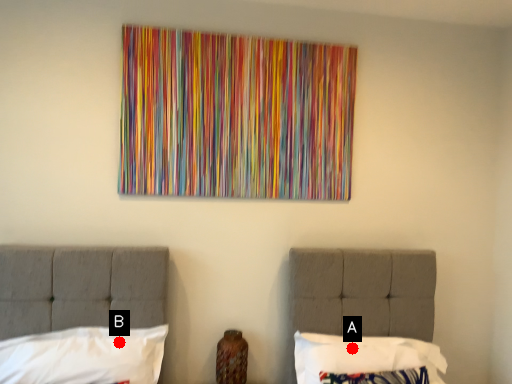
Question: Two points are circled on the image, labeled by A and B beside each circle. Which point is closer to the camera?

Choices:
 (A) A is closer
 (B) B is closer

Answer: (B)